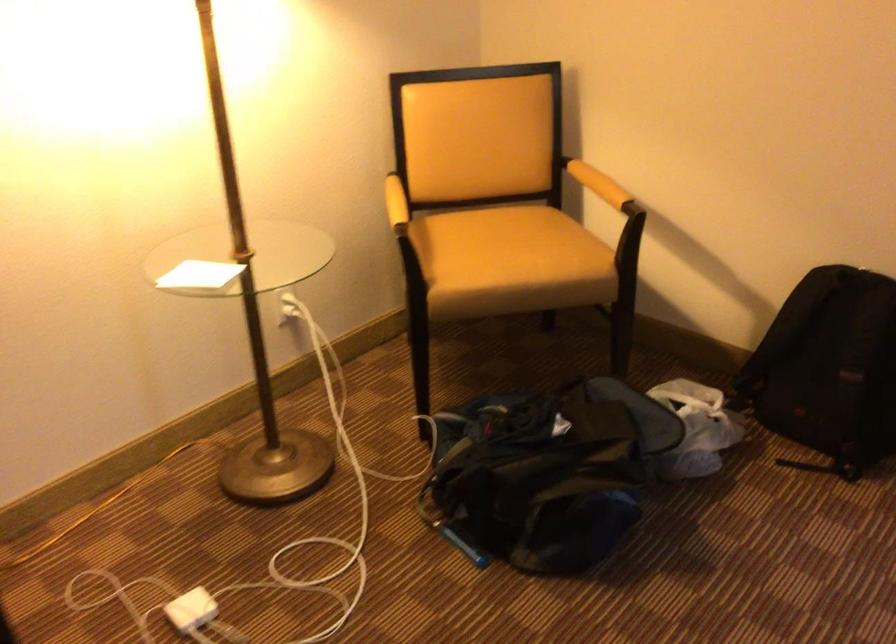
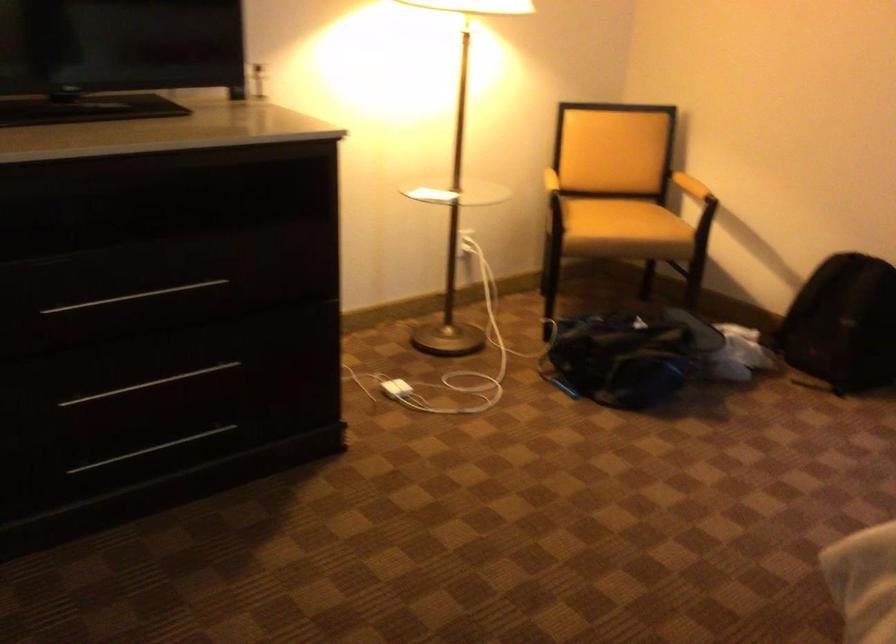
Where in the second image is the point corresponding to pixel 558 489 from the first image?

(627, 355)